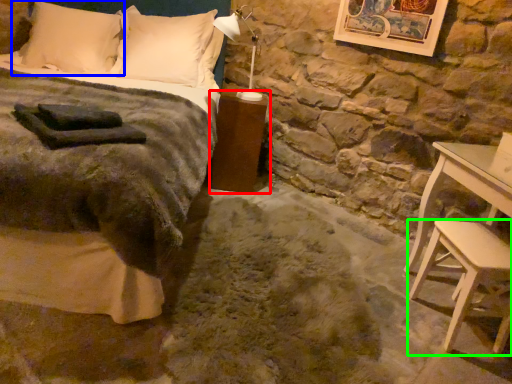
Question: Estimate the real-world distances between objects in this image. Which object is closer to nightstand (highlighted by a red box), pillow (highlighted by a blue box) or stool (highlighted by a green box)?

Choices:
 (A) pillow
 (B) stool

Answer: (A)